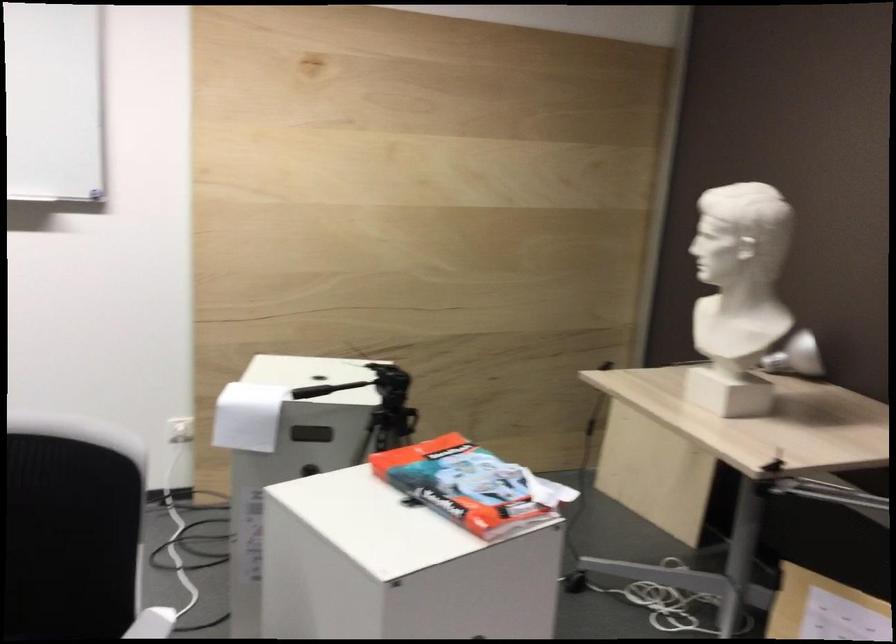
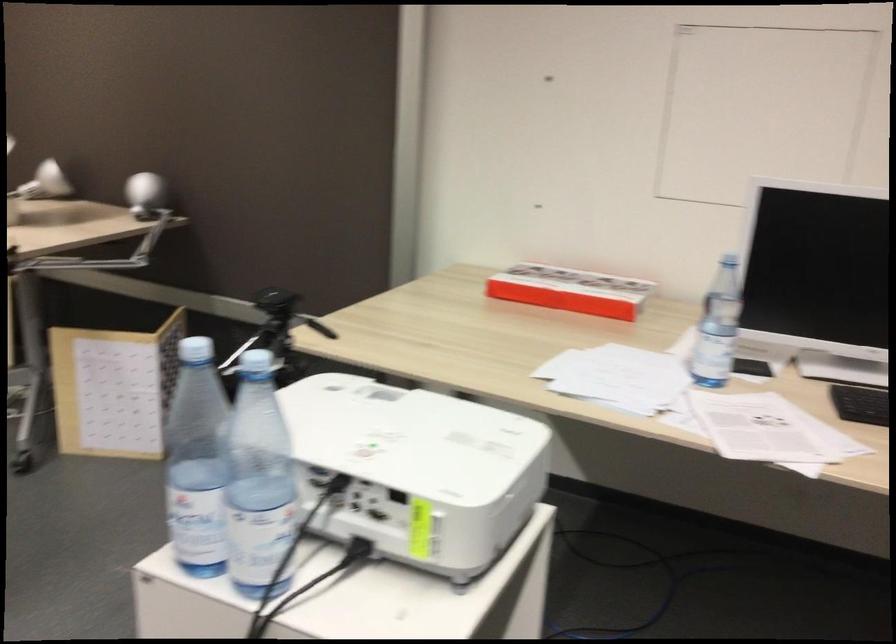
Question: The first image is from the beginning of the video and the second image is from the end. How did the camera likely rotate when shooting the video?

Choices:
 (A) Left
 (B) Right
 (C) Up
 (D) Down

Answer: (B)